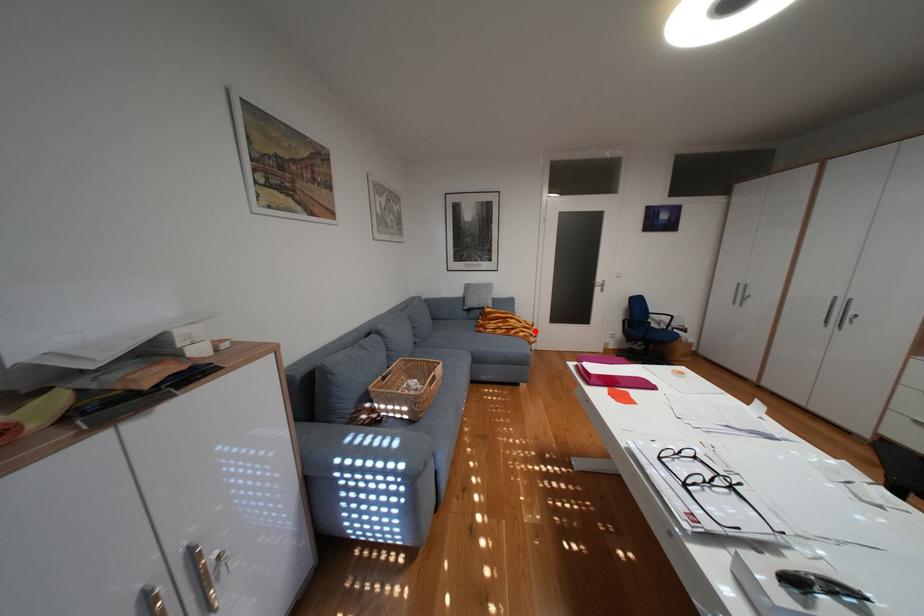
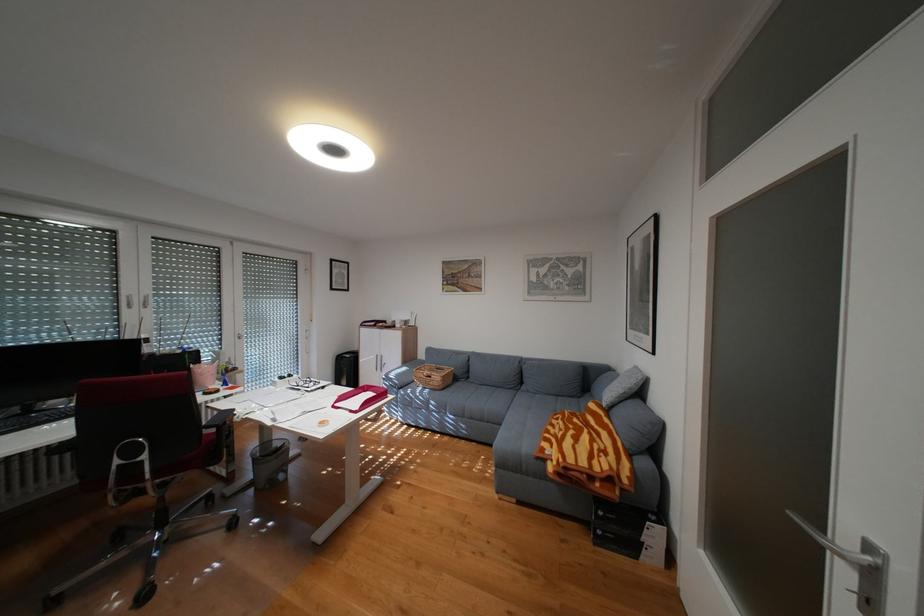
Question: A red point is marked in image1. In image2, is the corresponding 3D point closer to the camera or farther? Reply with the corresponding letter.

Choices:
 (A) The corresponding 3D point is closer.
 (B) The corresponding 3D point is farther.

Answer: (A)